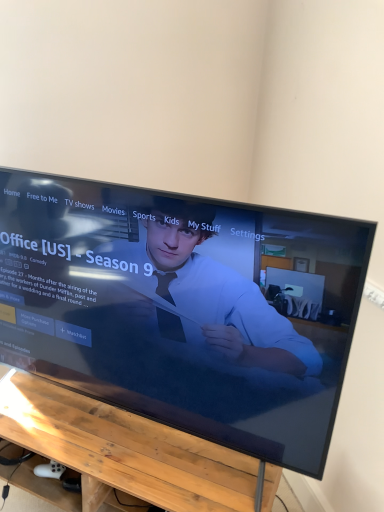
Image resolution: width=384 pixels, height=512 pixels. In order to click on vacant space underneath black glossy tv at center (from a real-world perspective) in this screenshot , I will do `click(127, 433)`.